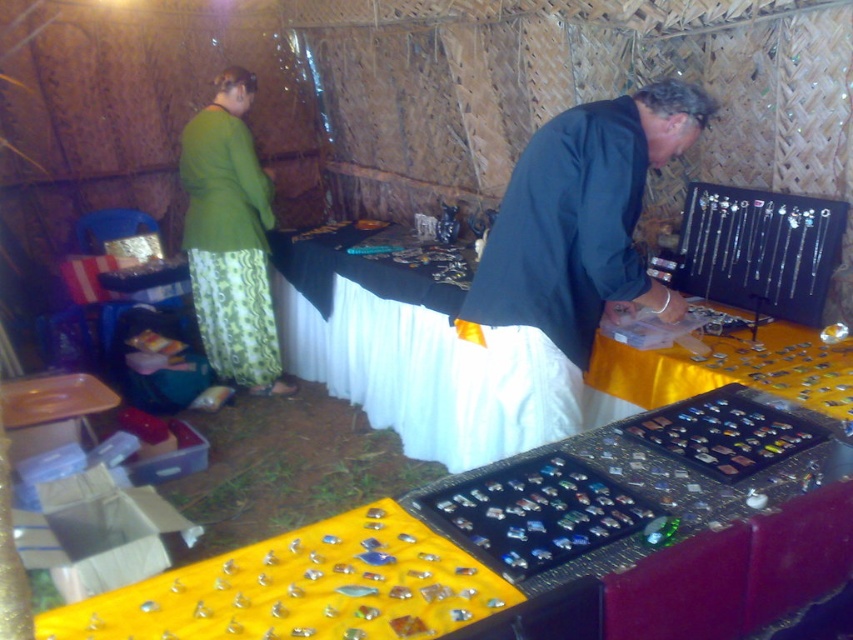
Question: Is yellow fabric at center wider than green fabric skirt at left?

Choices:
 (A) yes
 (B) no

Answer: (A)

Question: Which point is farther to the camera?

Choices:
 (A) green fabric skirt at left
 (B) yellow fabric at center

Answer: (A)

Question: Which object appears farthest from the camera in this image?

Choices:
 (A) dark green fabric at center
 (B) yellow fabric at center

Answer: (A)

Question: Can you confirm if yellow fabric at center is wider than dark green fabric at center?

Choices:
 (A) no
 (B) yes

Answer: (B)

Question: Which of the following is the closest to the observer?

Choices:
 (A) green fabric skirt at left
 (B) yellow fabric at center
 (C) dark green fabric at center

Answer: (B)

Question: Is yellow fabric at center thinner than dark green fabric at center?

Choices:
 (A) yes
 (B) no

Answer: (B)